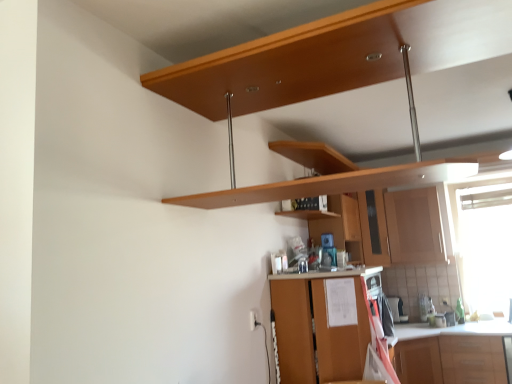
I want to click on wooden shelf at center, so click(x=308, y=214).

What is the approximate width of matte wood cabinet at center-right, acting as the 2th cabinetry starting from the back?

The width of matte wood cabinet at center-right, acting as the 2th cabinetry starting from the back, is 13.84 inches.

What are the coordinates of `white glossy electric outlet at lower center` in the screenshot? It's located at (253, 320).

Considering the sizes of brown wood cabinet at lower center, which is the first cabinetry from front to back, and matte wood cabinet at center-right, acting as the 2th cabinetry starting from the back, in the image, is brown wood cabinet at lower center, which is the first cabinetry from front to back, wider or thinner than matte wood cabinet at center-right, acting as the 2th cabinetry starting from the back,?

Considering their sizes, brown wood cabinet at lower center, which is the first cabinetry from front to back, looks broader than matte wood cabinet at center-right, acting as the 2th cabinetry starting from the back.

Is brown wood cabinet at lower center, which is the first cabinetry from front to back, smaller than matte wood cabinet at center-right, acting as the 2th cabinetry starting from the back?

Actually, brown wood cabinet at lower center, which is the first cabinetry from front to back, might be larger than matte wood cabinet at center-right, acting as the 2th cabinetry starting from the back.

Which is correct: brown wood cabinet at lower center, the third cabinetry positioned from the back, is inside matte wood cabinet at center-right, which ranks as the second cabinetry in front-to-back order, or outside of it?

brown wood cabinet at lower center, the third cabinetry positioned from the back, is not inside matte wood cabinet at center-right, which ranks as the second cabinetry in front-to-back order, it's outside.

Is brown wood cabinet at lower center, the third cabinetry positioned from the back, oriented towards matte wood cabinet at center-right, which ranks as the second cabinetry in front-to-back order?

No, brown wood cabinet at lower center, the third cabinetry positioned from the back, is not turned towards matte wood cabinet at center-right, which ranks as the second cabinetry in front-to-back order.

Does white glossy electric outlet at lower center have a smaller size compared to satin black coffee maker at lower right?

Yes.

Does white glossy electric outlet at lower center appear on the left side of satin black coffee maker at lower right?

Yes.

Between white glossy electric outlet at lower center and satin black coffee maker at lower right, which one is positioned behind?

satin black coffee maker at lower right is further away from the camera.

Does transparent plastic window screen at right appear on the right side of wooden shelf at center?

Yes.

From a real-world perspective, which is physically above, transparent plastic window screen at right or wooden shelf at center?

From a 3D spatial view, wooden shelf at center is above.

Is transparent plastic window screen at right far from wooden shelf at center?

Yes, transparent plastic window screen at right and wooden shelf at center are located far from each other.

Can you confirm if transparent plastic window screen at right is taller than wooden shelf at center?

Indeed, transparent plastic window screen at right has a greater height compared to wooden shelf at center.

Does wooden shelf at center turn towards transparent plastic window screen at right?

No, wooden shelf at center is not oriented towards transparent plastic window screen at right.

Is point (313, 215) closer or farther from the camera than point (507, 255)?

Point (313, 215).

Looking at this image, how different are the orientations of wooden shelf at center and transparent plastic window screen at right in degrees?

They differ by 89.3 degrees in their facing directions.

Where is `window screen lying below the wooden shelf at center (from the image's perspective)`? window screen lying below the wooden shelf at center (from the image's perspective) is located at coordinates (485, 246).

From a real-world perspective, is satin black coffee maker at lower right above or below transparent plastic window screen at right?

In terms of real-world spatial position, satin black coffee maker at lower right is below transparent plastic window screen at right.

Between satin black coffee maker at lower right and transparent plastic window screen at right, which one appears on the left side from the viewer's perspective?

Positioned to the left is satin black coffee maker at lower right.

Considering their positions, is satin black coffee maker at lower right located in front of or behind transparent plastic window screen at right?

satin black coffee maker at lower right is positioned farther from the viewer than transparent plastic window screen at right.

Can we say brown wood cabinet at lower center, the third cabinetry positioned from the back, lies outside transparent plastic window screen at right?

Yes, brown wood cabinet at lower center, the third cabinetry positioned from the back, is outside of transparent plastic window screen at right.

Looking at the image, does brown wood cabinet at lower center, the third cabinetry positioned from the back, seem bigger or smaller compared to transparent plastic window screen at right?

brown wood cabinet at lower center, the third cabinetry positioned from the back, is bigger than transparent plastic window screen at right.

Based on the photo, is brown wood cabinet at lower center, which is the first cabinetry from front to back, with transparent plastic window screen at right?

They are not placed beside each other.

Which of these two, brown wood cabinet at lower center, the third cabinetry positioned from the back, or satin black coffee maker at lower right, is bigger?

With larger size is brown wood cabinet at lower center, the third cabinetry positioned from the back.

From a real-world perspective, is brown wood cabinet at lower center, which is the first cabinetry from front to back, above or below satin black coffee maker at lower right?

Clearly, from a real-world perspective, brown wood cabinet at lower center, which is the first cabinetry from front to back, is below satin black coffee maker at lower right.

Can you confirm if brown wood cabinet at lower center, the third cabinetry positioned from the back, is shorter than satin black coffee maker at lower right?

In fact, brown wood cabinet at lower center, the third cabinetry positioned from the back, may be taller than satin black coffee maker at lower right.

Is brown wood cabinet at lower center, the third cabinetry positioned from the back, aimed at satin black coffee maker at lower right?

No, brown wood cabinet at lower center, the third cabinetry positioned from the back, is not facing towards satin black coffee maker at lower right.

Where is `cabinetry lying below the matte wood cabinet at center-right, acting as the 2th cabinetry starting from the back (from the image's perspective)`? cabinetry lying below the matte wood cabinet at center-right, acting as the 2th cabinetry starting from the back (from the image's perspective) is located at coordinates (318, 328).

The width and height of the screenshot is (512, 384). In order to click on appliance that is on the right side of white glossy electric outlet at lower center in this screenshot , I will do tap(397, 309).

Considering their positions, is matte wood cabinet at center-right, which ranks as the second cabinetry in front-to-back order, positioned further to wooden cabinet at center, which is counted as the third cabinetry, starting from the front, than wooden shelf at center?

wooden shelf at center lies further to wooden cabinet at center, which is counted as the third cabinetry, starting from the front, than the other object.

Looking at the image, which one is located closer to wooden cabinet at center, which is counted as the third cabinetry, starting from the front, brown wood cabinet at lower center, which is the first cabinetry from front to back, or white glossy electric outlet at lower center?

brown wood cabinet at lower center, which is the first cabinetry from front to back, lies closer to wooden cabinet at center, which is counted as the third cabinetry, starting from the front, than the other object.

Considering their positions, is wooden shelf at center positioned further to matte wood cabinet at center-right, which ranks as the second cabinetry in front-to-back order, than brown wood cabinet at lower center, the third cabinetry positioned from the back?

brown wood cabinet at lower center, the third cabinetry positioned from the back, is further to matte wood cabinet at center-right, which ranks as the second cabinetry in front-to-back order.

From the image, which object appears to be farther from matte wood cabinet at center-right, which ranks as the second cabinetry in front-to-back order, wooden shelf at center or transparent plastic window screen at right?

wooden shelf at center.

When comparing their distances from wooden shelf at center, does transparent plastic window screen at right or wooden cabinet at center, which is counted as the first cabinetry, starting from the back, seem closer?

wooden cabinet at center, which is counted as the first cabinetry, starting from the back.

Looking at the image, which one is located further to wooden shelf at center, wooden cabinet at center, which is counted as the third cabinetry, starting from the front, or matte wood cabinet at center-right, which ranks as the second cabinetry in front-to-back order?

matte wood cabinet at center-right, which ranks as the second cabinetry in front-to-back order, is further to wooden shelf at center.

Based on the photo, from the image, which object appears to be farther from white glossy electric outlet at lower center, satin black coffee maker at lower right or wooden cabinet at center, which is counted as the third cabinetry, starting from the front?

Based on the image, satin black coffee maker at lower right appears to be further to white glossy electric outlet at lower center.

Considering their positions, is matte wood cabinet at center-right, acting as the 2th cabinetry starting from the back, positioned closer to white glossy electric outlet at lower center than brown wood cabinet at lower center, which is the first cabinetry from front to back?

Among the two, brown wood cabinet at lower center, which is the first cabinetry from front to back, is located nearer to white glossy electric outlet at lower center.

Identify the location of cabinetry between wooden cabinet at center, which is counted as the third cabinetry, starting from the front, and transparent plastic window screen at right from left to right. [415, 226].

Locate an element on the screen. The height and width of the screenshot is (384, 512). electric outlet between brown wood cabinet at lower center, the third cabinetry positioned from the back, and matte wood cabinet at center-right, which ranks as the second cabinetry in front-to-back order, in the front-back direction is located at coordinates (253, 320).

Image resolution: width=512 pixels, height=384 pixels. In order to click on window screen between brown wood cabinet at lower center, the third cabinetry positioned from the back, and satin black coffee maker at lower right, along the z-axis in this screenshot , I will do `click(485, 246)`.

The width and height of the screenshot is (512, 384). In order to click on cabinetry between wooden shelf at center and wooden cabinet at center, which is counted as the first cabinetry, starting from the back, from front to back in this screenshot , I will do `click(415, 226)`.